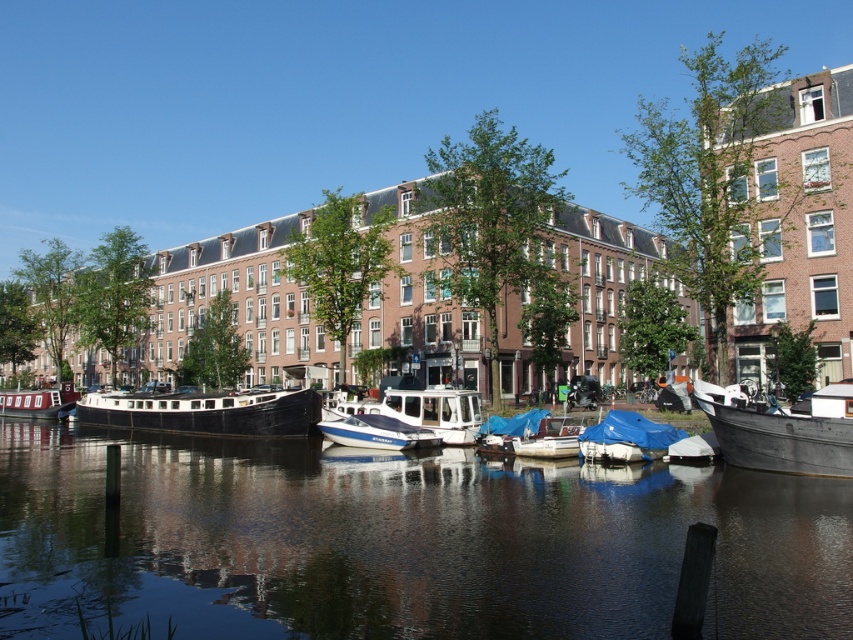
You are standing on the dock and see the smooth dark water at center and the blue glossy boat at center. Which object is closer to you?

The smooth dark water at center is closer to you because it is in front of the blue glossy boat at center.

Looking at this image, you are a tour guide explaining the canal boats to visitors. You mention both the rusty metal boat at right and the blue tarpaulin boat at center. Which boat would you describe as bigger in size?

The rusty metal boat at right is larger in size than the blue tarpaulin boat at center.